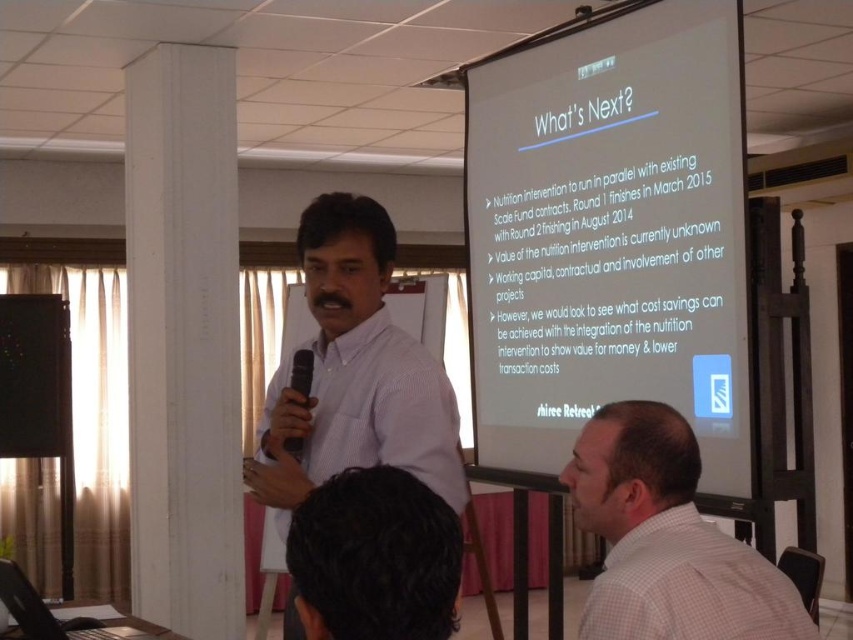
Question: Among these points, which one is nearest to the camera?

Choices:
 (A) (308, 392)
 (B) (647, 100)

Answer: (A)

Question: Does dark brown hair at upper center appear over black plastic microphone at center?

Choices:
 (A) no
 (B) yes

Answer: (A)

Question: Which object appears closest to the camera in this image?

Choices:
 (A) black plastic microphone at center
 (B) white striped shirt at center
 (C) white matte projector screen at upper center
 (D) white checkered shirt at lower right

Answer: (D)

Question: Is white striped shirt at center smaller than black plastic microphone at center?

Choices:
 (A) no
 (B) yes

Answer: (A)

Question: Is white striped shirt at center positioned at the back of dark brown hair at upper center?

Choices:
 (A) yes
 (B) no

Answer: (A)

Question: Which of the following is the closest to the observer?

Choices:
 (A) (300, 371)
 (B) (328, 320)
 (C) (640, 204)

Answer: (B)